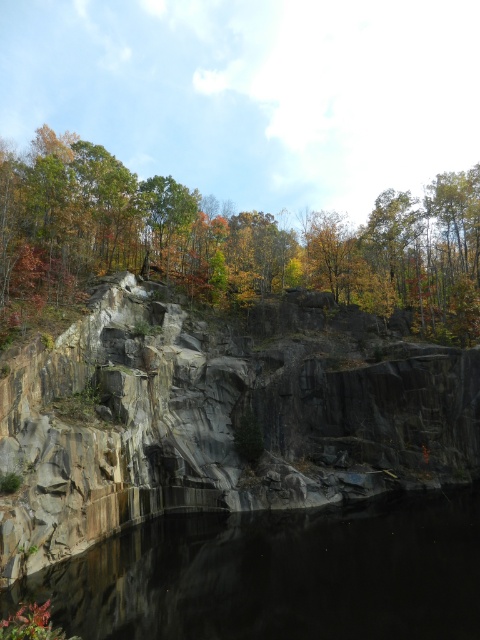
Question: Considering the relative positions of gray/rocky cliff at center and green matte tree at upper center in the image provided, where is gray/rocky cliff at center located with respect to green matte tree at upper center?

Choices:
 (A) left
 (B) right

Answer: (A)

Question: Which point is closer to the camera?

Choices:
 (A) green matte tree at upper center
 (B) gray/rocky cliff at center

Answer: (B)

Question: Among these points, which one is nearest to the camera?

Choices:
 (A) (216, 392)
 (B) (33, 268)

Answer: (B)

Question: Can you confirm if gray/rocky cliff at center is wider than green matte tree at upper center?

Choices:
 (A) yes
 (B) no

Answer: (B)

Question: Does gray/rocky cliff at center appear on the right side of green matte tree at upper center?

Choices:
 (A) no
 (B) yes

Answer: (A)